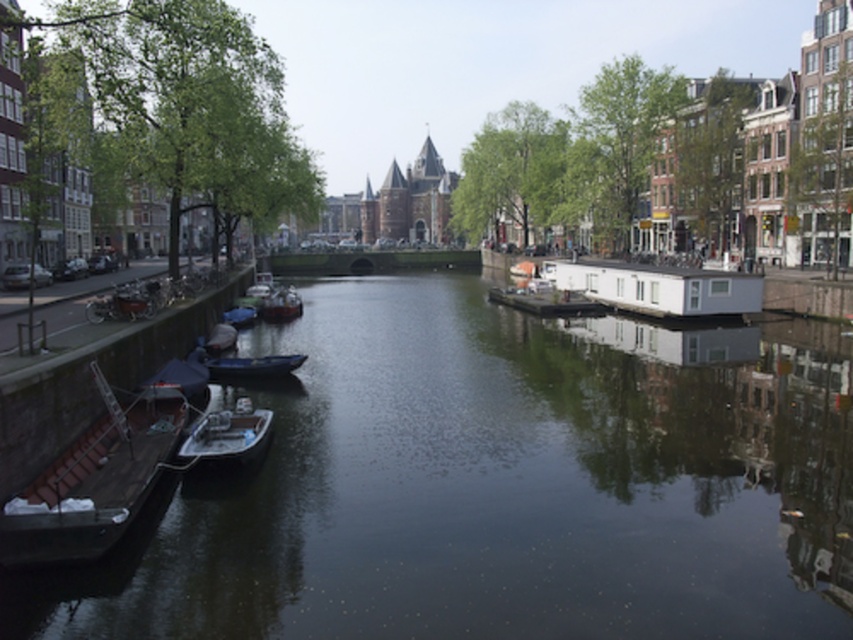
You are standing on the embankment on the left side of the canal. You see a point marked at coordinates [281,305]. What object is located at that point?

The point at coordinates [281,305] corresponds to the white glossy boat at center.

You are standing on the embankment looking at the canal. You see the green smooth water at center and the blue matte boat at center. Which object is closer to you?

The green smooth water at center is closer to you because it is in front of the blue matte boat at center.